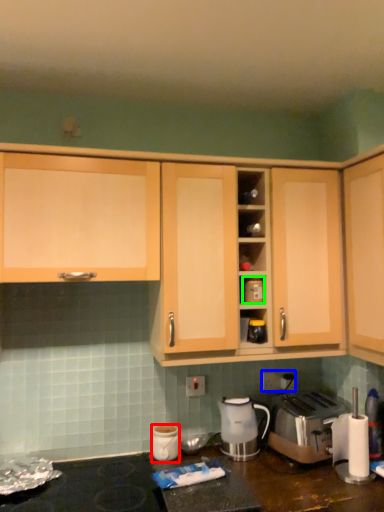
Question: Which object is positioned farthest from kitchen appliance (highlighted by a red box)? Select from electric outlet (highlighted by a blue box) and appliance (highlighted by a green box).

Choices:
 (A) electric outlet
 (B) appliance

Answer: (B)